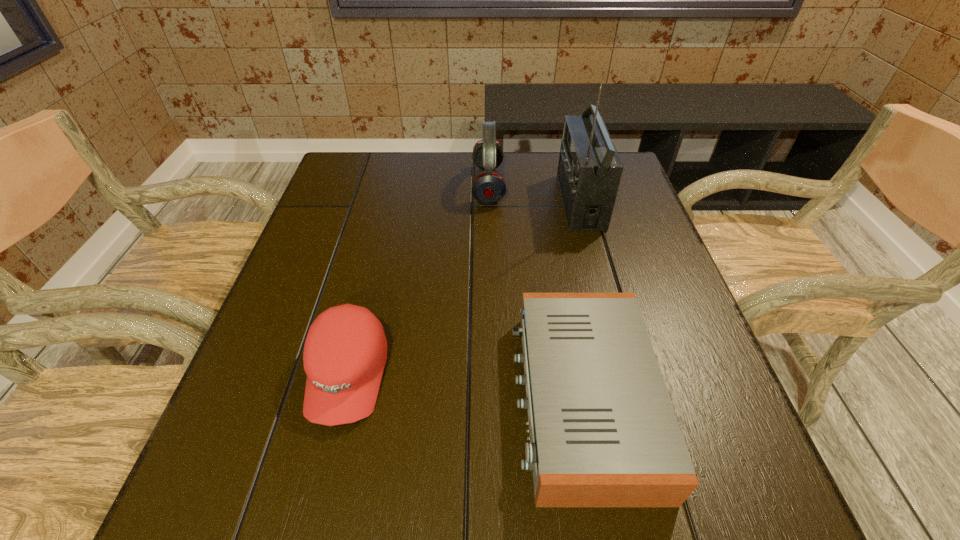
This screenshot has height=540, width=960. I want to click on the taller radio receiver, so click(589, 171).

Where is `the tallest object`? This screenshot has height=540, width=960. the tallest object is located at coordinates (589, 171).

Where is `the second tallest object`? The image size is (960, 540). the second tallest object is located at coordinates (488, 187).

Identify the location of the second shortest object. (345, 351).

Locate an element on the screen. The height and width of the screenshot is (540, 960). cap is located at coordinates (345, 351).

At what (x,y) coordinates should I click in order to perform the action: click on the nearer radio receiver. Please return your answer as a coordinate pair (x, y). Looking at the image, I should click on (603, 432).

Find the location of a particular element. the shorter radio receiver is located at coordinates (603, 432).

The image size is (960, 540). Identify the location of vacant space situated 0.140m on the front panel of the tallest object. (510, 201).

This screenshot has height=540, width=960. I want to click on vacant space located on the front panel of the tallest object, so click(432, 201).

At what (x,y) coordinates should I click in order to perform the action: click on vacant region located on the front panel of the tallest object. Please return your answer as a coordinate pair (x, y). Looking at the image, I should click on (510, 201).